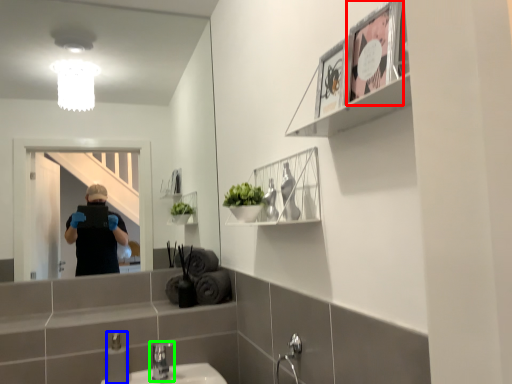
Question: Based on their relative distances, which object is nearer to picture frame (highlighted by a red box)? Choose from toiletry (highlighted by a blue box) and tap (highlighted by a green box).

Choices:
 (A) toiletry
 (B) tap

Answer: (A)